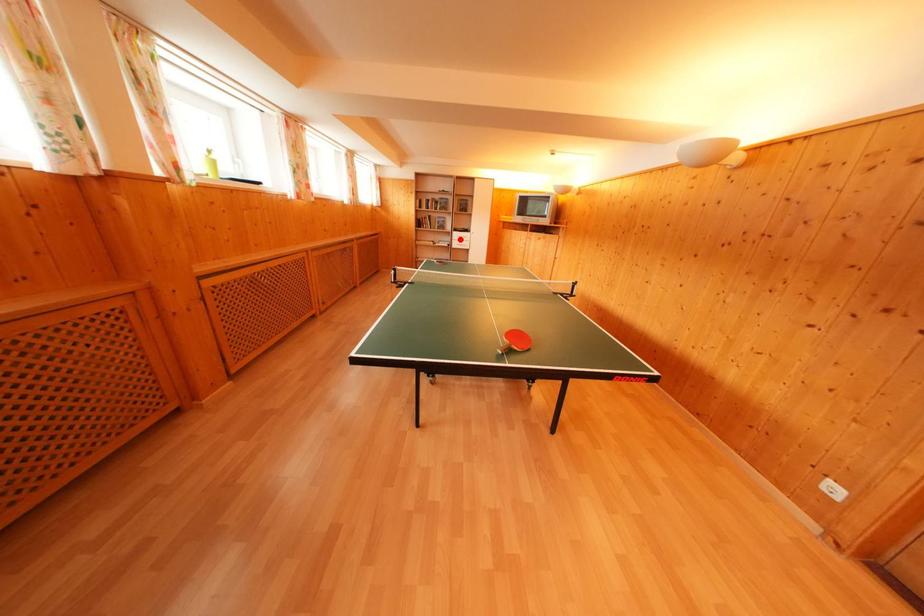
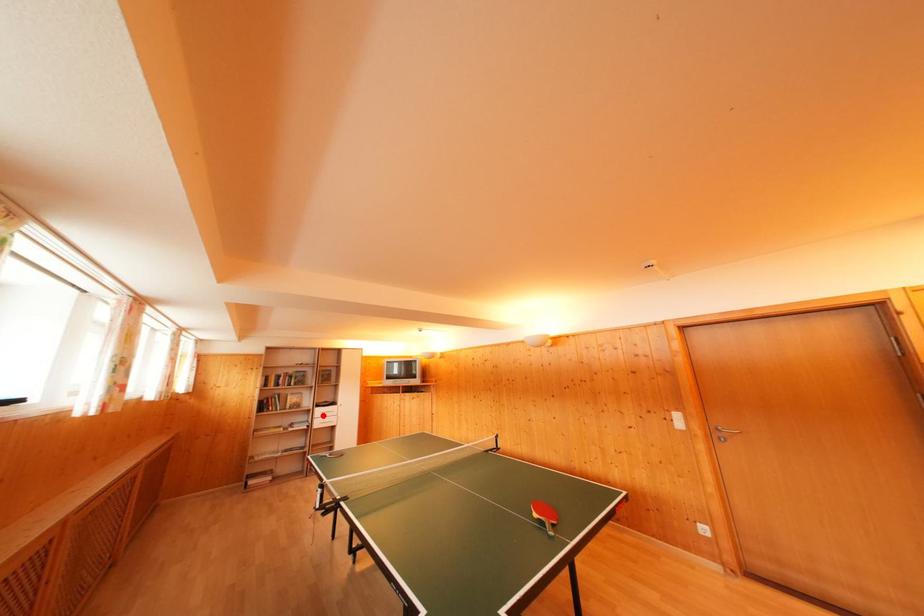
I am providing you with two images of the same scene from different viewpoints. A red point is marked on the first image and another point is marked on the second image. Are the points marked in image1 and image2 representing the same 3D position?

Yes